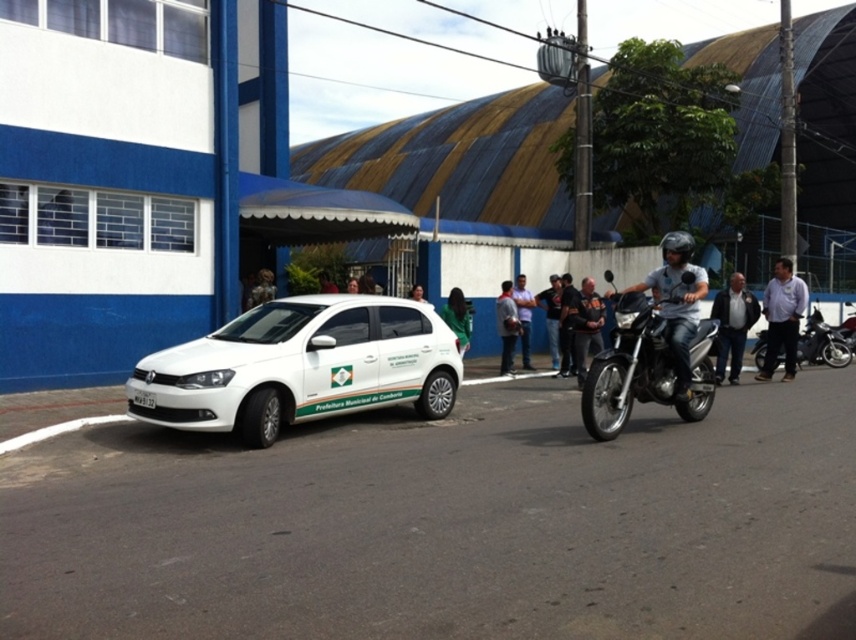
Question: Is metallic silver motorcycle at right smaller than white shirt at center?

Choices:
 (A) no
 (B) yes

Answer: (A)

Question: Which point appears closest to the camera in this image?

Choices:
 (A) (498, 369)
 (B) (735, 314)
 (C) (520, 312)
 (D) (308, 353)

Answer: (D)

Question: From the image, what is the correct spatial relationship of shiny silver motorcycle at right in relation to shiny black motorcycle at right?

Choices:
 (A) right
 (B) left

Answer: (B)

Question: Can you confirm if light blue shirt at center is thinner than green fabric shirt at center?

Choices:
 (A) no
 (B) yes

Answer: (A)

Question: Which of the following is the closest to the observer?

Choices:
 (A) (655, 288)
 (B) (721, 362)

Answer: (A)

Question: Which object is positioned closest to the white matte hatchback at center?

Choices:
 (A) white shirt at center
 (B) dark blue leather jacket at right
 (C) shiny silver motorcycle at right

Answer: (C)